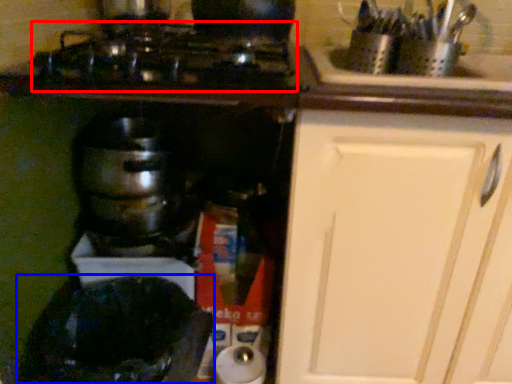
Question: Which of the following is the farthest to the observer, gas stove (highlighted by a red box) or appliance (highlighted by a blue box)?

Choices:
 (A) gas stove
 (B) appliance

Answer: (B)